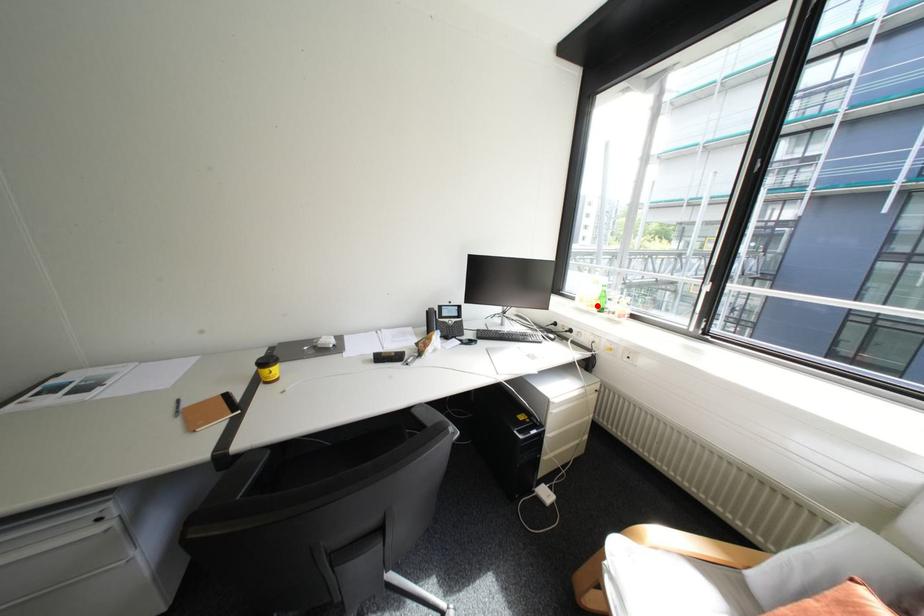
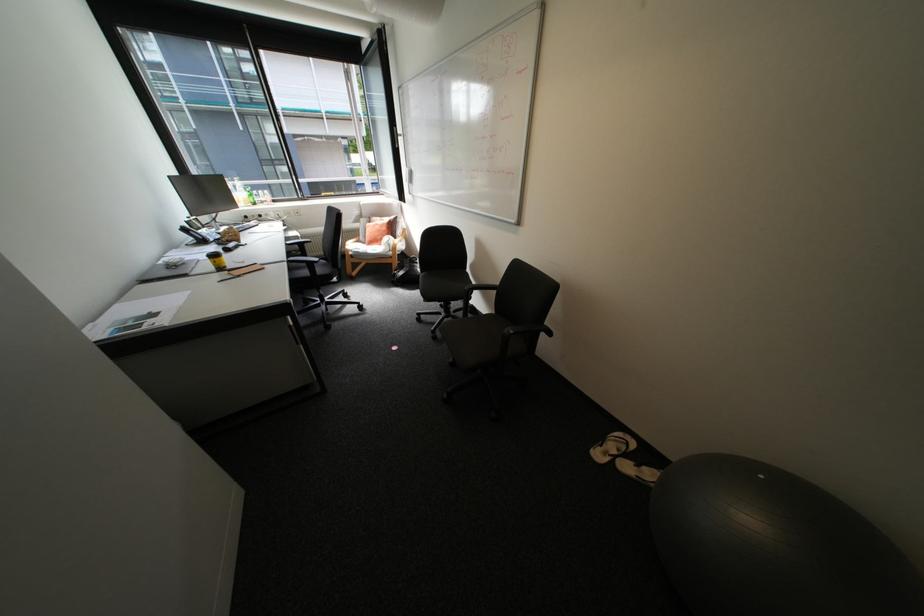
In the second image, find the point that corresponds to the highlighted location in the first image.

(256, 204)